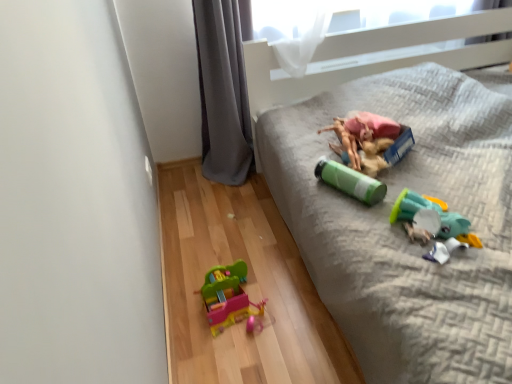
How much space does multicolored plastic toy at lower center, marked as the 1th toy in a bottom-to-top arrangement, occupy horizontally?

multicolored plastic toy at lower center, marked as the 1th toy in a bottom-to-top arrangement, is 9.44 inches in width.

Locate an element on the screen. rubberized plastic toy at center, the first toy when ordered from top to bottom is located at coordinates (370, 141).

Where is `translucent plastic toy at lower right, the third toy in the top-to-bottom sequence`? The image size is (512, 384). translucent plastic toy at lower right, the third toy in the top-to-bottom sequence is located at coordinates [433, 224].

This screenshot has width=512, height=384. Find the location of `green matte water bottle at upper right`. green matte water bottle at upper right is located at coordinates (402, 230).

Describe the element at coordinates (350, 181) in the screenshot. I see `green matte water bottle at center, the 2th toy viewed from the top` at that location.

This screenshot has width=512, height=384. Find the location of `multicolored plastic toy at lower center, marked as the 1th toy in a bottom-to-top arrangement`. multicolored plastic toy at lower center, marked as the 1th toy in a bottom-to-top arrangement is located at coordinates (228, 297).

Which object is wider, gray fabric curtain at lower left or green matte water bottle at upper right?

With larger width is green matte water bottle at upper right.

Is gray fabric curtain at lower left aimed at green matte water bottle at upper right?

No, gray fabric curtain at lower left is not turned towards green matte water bottle at upper right.

From the image's perspective, between gray fabric curtain at lower left and green matte water bottle at upper right, which one is located above?

gray fabric curtain at lower left appears higher in the image.

Would you say green matte water bottle at upper right is part of gray fabric curtain at lower left's contents?

No, green matte water bottle at upper right is not a part of gray fabric curtain at lower left.

Considering the relative sizes of green matte water bottle at upper right and multicolored plastic toy at lower center, the 4th toy positioned from the top, in the image provided, is green matte water bottle at upper right bigger than multicolored plastic toy at lower center, the 4th toy positioned from the top,?

Indeed, green matte water bottle at upper right has a larger size compared to multicolored plastic toy at lower center, the 4th toy positioned from the top.

From the image's perspective, is green matte water bottle at upper right located above or below multicolored plastic toy at lower center, marked as the 1th toy in a bottom-to-top arrangement?

green matte water bottle at upper right is above multicolored plastic toy at lower center, marked as the 1th toy in a bottom-to-top arrangement.

Does green matte water bottle at upper right have a greater height compared to multicolored plastic toy at lower center, the 4th toy positioned from the top?

Correct, green matte water bottle at upper right is much taller as multicolored plastic toy at lower center, the 4th toy positioned from the top.

Does point (448, 359) appear closer or farther from the camera than point (212, 291)?

Clearly, point (448, 359) is closer to the camera than point (212, 291).

Is translucent plastic toy at lower right, the third toy in the top-to-bottom sequence, smaller than gray fabric curtain at lower left?

Yes, translucent plastic toy at lower right, the third toy in the top-to-bottom sequence, is smaller than gray fabric curtain at lower left.

Is translucent plastic toy at lower right, the 2th toy ordered from the bottom, turned away from gray fabric curtain at lower left?

Yes, translucent plastic toy at lower right, the 2th toy ordered from the bottom,'s orientation is away from gray fabric curtain at lower left.

From the image's perspective, which object appears higher, translucent plastic toy at lower right, the 2th toy ordered from the bottom, or gray fabric curtain at lower left?

gray fabric curtain at lower left is shown above in the image.

Could rubberized plastic toy at center, the first toy when ordered from top to bottom, be considered to be inside green matte water bottle at upper right?

That's correct, rubberized plastic toy at center, the first toy when ordered from top to bottom, is inside green matte water bottle at upper right.

Is green matte water bottle at upper right beside rubberized plastic toy at center, the first toy when ordered from top to bottom?

No, green matte water bottle at upper right is not touching rubberized plastic toy at center, the first toy when ordered from top to bottom.

Between green matte water bottle at upper right and rubberized plastic toy at center, the 4th toy in the bottom-to-top sequence, which one has more height?

green matte water bottle at upper right is taller.

Between point (266, 127) and point (342, 136), which one is positioned behind?

The point (266, 127) is farther from the camera.

Considering the positions of objects rubberized plastic toy at center, the 4th toy in the bottom-to-top sequence, and green matte water bottle at upper right in the image provided, who is more to the right, rubberized plastic toy at center, the 4th toy in the bottom-to-top sequence, or green matte water bottle at upper right?

From the viewer's perspective, green matte water bottle at upper right appears more on the right side.

Is rubberized plastic toy at center, the 4th toy in the bottom-to-top sequence, next to green matte water bottle at upper right?

They are not placed beside each other.

Between rubberized plastic toy at center, the first toy when ordered from top to bottom, and green matte water bottle at upper right, which one has less height?

Standing shorter between the two is rubberized plastic toy at center, the first toy when ordered from top to bottom.

Does rubberized plastic toy at center, the first toy when ordered from top to bottom, contain green matte water bottle at upper right?

Definitely not — green matte water bottle at upper right is not inside rubberized plastic toy at center, the first toy when ordered from top to bottom.

From their relative heights in the image, would you say gray fabric curtain at lower left is taller or shorter than green matte water bottle at center, positioned as the 3th toy in bottom-to-top order?

Considering their sizes, gray fabric curtain at lower left has more height than green matte water bottle at center, positioned as the 3th toy in bottom-to-top order.

Which is farther, (239, 41) or (338, 169)?

Positioned behind is point (239, 41).

How many degrees apart are the facing directions of gray fabric curtain at lower left and green matte water bottle at center, the 2th toy viewed from the top?

25.2 degrees separate the facing orientations of gray fabric curtain at lower left and green matte water bottle at center, the 2th toy viewed from the top.

Image resolution: width=512 pixels, height=384 pixels. What are the coordinates of `the 3rd toy in front when counting from the gray fabric curtain at lower left` in the screenshot? It's located at (350, 181).

Is gray fabric curtain at lower left inside the boundaries of rubberized plastic toy at center, the first toy when ordered from top to bottom, or outside?

gray fabric curtain at lower left is not enclosed by rubberized plastic toy at center, the first toy when ordered from top to bottom.

How different are the orientations of gray fabric curtain at lower left and rubberized plastic toy at center, the 4th toy in the bottom-to-top sequence, in degrees?

gray fabric curtain at lower left and rubberized plastic toy at center, the 4th toy in the bottom-to-top sequence, are facing 1.03 degrees away from each other.

Is gray fabric curtain at lower left turned away from rubberized plastic toy at center, the first toy when ordered from top to bottom?

No, gray fabric curtain at lower left is not facing away from rubberized plastic toy at center, the first toy when ordered from top to bottom.

Considering the points (234, 61) and (393, 136), which point is in front, point (234, 61) or point (393, 136)?

Point (393, 136)

Locate an element on the screen. furniture that appears in front of the gray fabric curtain at lower left is located at coordinates (402, 230).

Where is `furniture located above the multicolored plastic toy at lower center, the 4th toy positioned from the top (from a real-world perspective)`? The image size is (512, 384). furniture located above the multicolored plastic toy at lower center, the 4th toy positioned from the top (from a real-world perspective) is located at coordinates (402, 230).

Estimate the real-world distances between objects in this image. Which object is closer to multicolored plastic toy at lower center, the 4th toy positioned from the top, green matte water bottle at center, positioned as the 3th toy in bottom-to-top order, or rubberized plastic toy at center, the first toy when ordered from top to bottom?

green matte water bottle at center, positioned as the 3th toy in bottom-to-top order, is closer to multicolored plastic toy at lower center, the 4th toy positioned from the top.

Estimate the real-world distances between objects in this image. Which object is closer to multicolored plastic toy at lower center, the 4th toy positioned from the top, translucent plastic toy at lower right, the 2th toy ordered from the bottom, or rubberized plastic toy at center, the first toy when ordered from top to bottom?

Among the two, translucent plastic toy at lower right, the 2th toy ordered from the bottom, is located nearer to multicolored plastic toy at lower center, the 4th toy positioned from the top.

Based on their spatial positions, is gray fabric curtain at lower left or green matte water bottle at center, the 2th toy viewed from the top, closer to green matte water bottle at upper right?

green matte water bottle at center, the 2th toy viewed from the top, is closer to green matte water bottle at upper right.

Based on their spatial positions, is multicolored plastic toy at lower center, the 4th toy positioned from the top, or gray fabric curtain at lower left further from green matte water bottle at upper right?

The object further to green matte water bottle at upper right is gray fabric curtain at lower left.

When comparing their distances from green matte water bottle at center, the 2th toy viewed from the top, does rubberized plastic toy at center, the first toy when ordered from top to bottom, or translucent plastic toy at lower right, the 2th toy ordered from the bottom, seem closer?

The object closer to green matte water bottle at center, the 2th toy viewed from the top, is rubberized plastic toy at center, the first toy when ordered from top to bottom.

When comparing their distances from green matte water bottle at center, positioned as the 3th toy in bottom-to-top order, does translucent plastic toy at lower right, the third toy in the top-to-bottom sequence, or gray fabric curtain at lower left seem further?

The object further to green matte water bottle at center, positioned as the 3th toy in bottom-to-top order, is gray fabric curtain at lower left.

Based on their spatial positions, is rubberized plastic toy at center, the first toy when ordered from top to bottom, or green matte water bottle at center, positioned as the 3th toy in bottom-to-top order, closer to green matte water bottle at upper right?

rubberized plastic toy at center, the first toy when ordered from top to bottom, lies closer to green matte water bottle at upper right than the other object.

Estimate the real-world distances between objects in this image. Which object is closer to rubberized plastic toy at center, the 4th toy in the bottom-to-top sequence, green matte water bottle at center, positioned as the 3th toy in bottom-to-top order, or green matte water bottle at upper right?

Based on the image, green matte water bottle at center, positioned as the 3th toy in bottom-to-top order, appears to be nearer to rubberized plastic toy at center, the 4th toy in the bottom-to-top sequence.

The image size is (512, 384). I want to click on toy between green matte water bottle at upper right and green matte water bottle at center, the 2th toy viewed from the top, from front to back, so click(x=433, y=224).